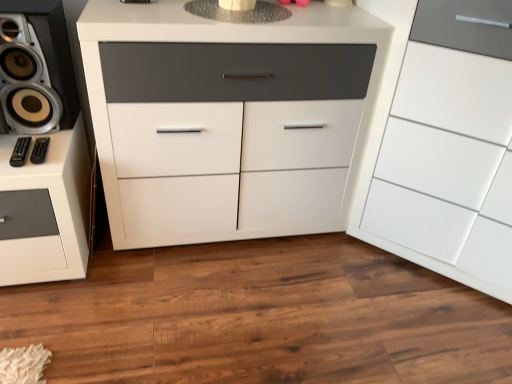
Question: Considering the relative sizes of white matte cabinet at center, marked as the first chest of drawers in a left-to-right arrangement, and black plastic remote control at lower left, which is the 1th audio in left-to-right order, in the image provided, is white matte cabinet at center, marked as the first chest of drawers in a left-to-right arrangement, shorter than black plastic remote control at lower left, which is the 1th audio in left-to-right order,?

Choices:
 (A) yes
 (B) no

Answer: (B)

Question: Is white matte cabinet at center, the 2th chest of drawers when ordered from right to left, wider than black plastic remote control at lower left, which is the 1th audio in left-to-right order?

Choices:
 (A) yes
 (B) no

Answer: (A)

Question: Is white matte cabinet at center, marked as the first chest of drawers in a left-to-right arrangement, further to camera compared to black plastic remote control at lower left, which is the 1th audio in left-to-right order?

Choices:
 (A) yes
 (B) no

Answer: (B)

Question: Does white matte cabinet at center, marked as the first chest of drawers in a left-to-right arrangement, have a larger size compared to black plastic remote control at lower left, which is the 1th audio in left-to-right order?

Choices:
 (A) yes
 (B) no

Answer: (A)

Question: From the image's perspective, is white matte cabinet at center, marked as the first chest of drawers in a left-to-right arrangement, beneath black plastic remote control at lower left, which is the 1th audio in left-to-right order?

Choices:
 (A) yes
 (B) no

Answer: (B)

Question: Considering the positions of white glossy cabinet at right, positioned as the 1th chest of drawers in right-to-left order, and black plastic remote control at lower left, which ranks as the 2th audio in left-to-right order, in the image, is white glossy cabinet at right, positioned as the 1th chest of drawers in right-to-left order, taller or shorter than black plastic remote control at lower left, which ranks as the 2th audio in left-to-right order,?

Choices:
 (A) tall
 (B) short

Answer: (A)

Question: Is white glossy cabinet at right, positioned as the 1th chest of drawers in right-to-left order, bigger or smaller than black plastic remote control at lower left, which ranks as the 2th audio in left-to-right order?

Choices:
 (A) small
 (B) big

Answer: (B)

Question: In the image, is white glossy cabinet at right, positioned as the 1th chest of drawers in right-to-left order, positioned in front of or behind black plastic remote control at lower left, which is the first audio in right-to-left order?

Choices:
 (A) front
 (B) behind

Answer: (A)

Question: Does point (484, 221) appear closer or farther from the camera than point (49, 139)?

Choices:
 (A) farther
 (B) closer

Answer: (A)

Question: Is white glossy cabinet at right, the second chest of drawers when ordered from left to right, to the left or to the right of metallic silver speaker at left in the image?

Choices:
 (A) right
 (B) left

Answer: (A)

Question: Is point (484, 115) positioned closer to the camera than point (7, 91)?

Choices:
 (A) farther
 (B) closer

Answer: (B)

Question: From a real-world perspective, is white glossy cabinet at right, positioned as the 1th chest of drawers in right-to-left order, physically located above or below metallic silver speaker at left?

Choices:
 (A) below
 (B) above

Answer: (A)

Question: Looking at their shapes, would you say white glossy cabinet at right, the second chest of drawers when ordered from left to right, is wider or thinner than metallic silver speaker at left?

Choices:
 (A) wide
 (B) thin

Answer: (A)

Question: From the image's perspective, relative to white matte cabinet at center, the 2th chest of drawers when ordered from right to left, is metallic silver speaker at left above or below?

Choices:
 (A) below
 (B) above

Answer: (B)

Question: Would you say metallic silver speaker at left is inside or outside white matte cabinet at center, marked as the first chest of drawers in a left-to-right arrangement?

Choices:
 (A) inside
 (B) outside

Answer: (B)